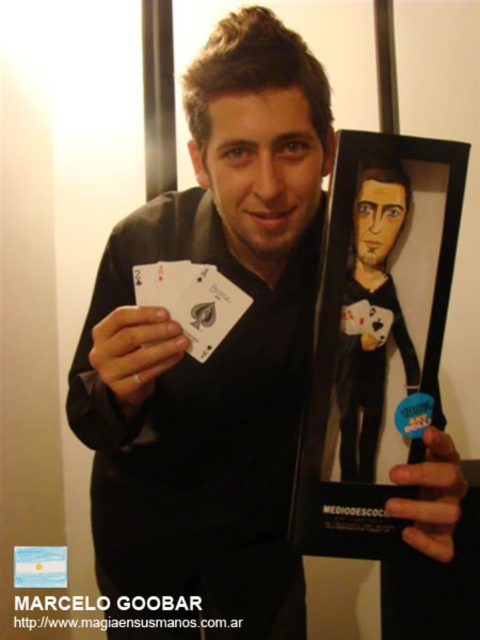
Question: Is black plastic picture frame at right closer to the viewer compared to matte black cards at center?

Choices:
 (A) yes
 (B) no

Answer: (B)

Question: From the image, what is the correct spatial relationship of black plastic picture frame at right in relation to matte black figure at center?

Choices:
 (A) right
 (B) left

Answer: (A)

Question: Where is black plastic picture frame at right located in relation to matte black cards at center in the image?

Choices:
 (A) right
 (B) left

Answer: (A)

Question: Which of these objects is positioned farthest from the matte black cards at center?

Choices:
 (A) black paper playing cards at center
 (B) matte black figure at center

Answer: (B)

Question: Among these objects, which one is nearest to the camera?

Choices:
 (A) black paper playing cards at center
 (B) black paper at center
 (C) matte black hand at center
 (D) matte black cards at center

Answer: (D)

Question: Which point is closer to the camera?

Choices:
 (A) matte black cards at center
 (B) black paper playing cards at center
 (C) matte black hand at center
 (D) black plastic picture frame at right

Answer: (A)